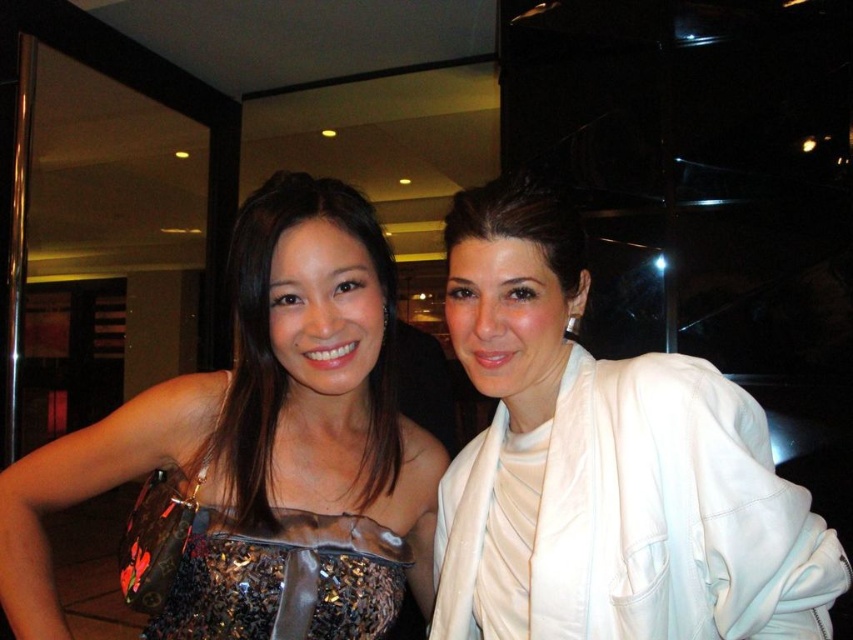
Question: Does white satin robe at right have a larger size compared to shiny sequined dress at center?

Choices:
 (A) no
 (B) yes

Answer: (B)

Question: Which object appears closest to the camera in this image?

Choices:
 (A) shiny sequined dress at center
 (B) white satin robe at right
 (C) sparkly sequined dress at lower left
 (D) sequined fabric dress at center

Answer: (B)

Question: Can you confirm if sparkly sequined dress at lower left is positioned above shiny sequined dress at center?

Choices:
 (A) yes
 (B) no

Answer: (B)

Question: Can you confirm if sequined fabric dress at center is bigger than sparkly sequined dress at lower left?

Choices:
 (A) no
 (B) yes

Answer: (B)

Question: Which point is farther to the camera?

Choices:
 (A) (277, 573)
 (B) (256, 384)

Answer: (B)

Question: Which object appears farthest from the camera in this image?

Choices:
 (A) shiny sequined dress at center
 (B) white satin robe at right
 (C) sparkly sequined dress at lower left

Answer: (C)